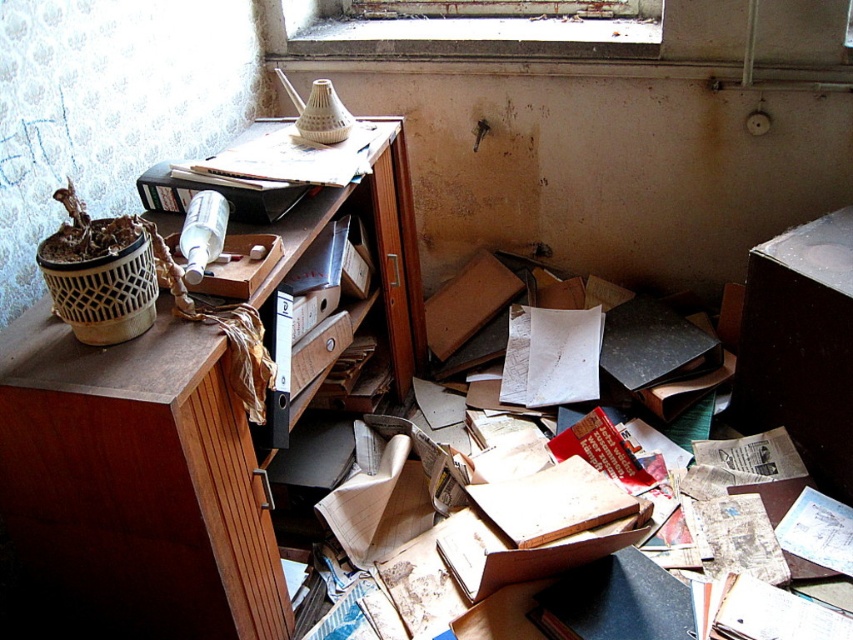
You are standing at the entrance of the room and see the point marked at (135, 484). What object is located at that point?

The brown wood dresser at upper left is located at point (135, 484).

You are a cleaning robot entering the room and need to reach the wooden drawer at center. There is a clear glass window at upper center in your path. Can you move around it?

The clear glass window at upper center is further to the viewer than the wooden drawer at center, so the window is closer to you. You can move around it to reach the wooden drawer at center.

You are organizing a messy office and need to move items from the brown wood dresser at upper left to the wooden drawer at center. Which object should you move first if you want to start with the one closer to you?

The brown wood dresser at upper left should be moved first because it is positioned on the left side of the wooden drawer at center, meaning it is closer to you.